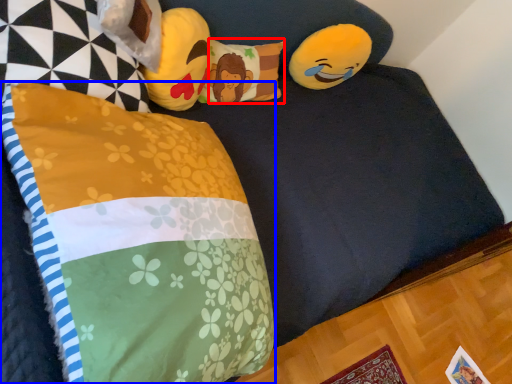
Question: Which object is closer to the camera taking this photo, pillow (highlighted by a red box) or pillow (highlighted by a blue box)?

Choices:
 (A) pillow
 (B) pillow

Answer: (B)